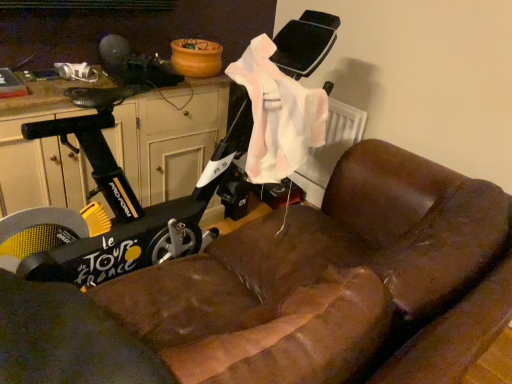
What do you see at coordinates (169, 137) in the screenshot? Image resolution: width=512 pixels, height=384 pixels. I see `wooden dresser at left` at bounding box center [169, 137].

Image resolution: width=512 pixels, height=384 pixels. Find the location of `wooden dresser at left`. wooden dresser at left is located at coordinates (169, 137).

The image size is (512, 384). In order to click on brown leather couch at lower right in this screenshot , I will do (293, 293).

Describe the element at coordinates (293, 293) in the screenshot. I see `brown leather couch at lower right` at that location.

Locate an element on the screen. wooden dresser at left is located at coordinates click(169, 137).

Between brown leather couch at lower right and wooden dresser at left, which one appears on the left side from the viewer's perspective?

wooden dresser at left is more to the left.

Is the depth of brown leather couch at lower right greater than that of wooden dresser at left?

That is False.

Is point (305, 380) closer to camera compared to point (189, 170)?

Yes.

From the image's perspective, is brown leather couch at lower right on top of wooden dresser at left?

Incorrect, from the image's perspective, brown leather couch at lower right is lower than wooden dresser at left.

From a real-world perspective, between brown leather couch at lower right and wooden dresser at left, who is vertically lower?

brown leather couch at lower right.

Which of these two, brown leather couch at lower right or wooden dresser at left, is thinner?

wooden dresser at left is thinner.

Between brown leather couch at lower right and wooden dresser at left, which one has less height?

Standing shorter between the two is wooden dresser at left.

Can you confirm if brown leather couch at lower right is smaller than wooden dresser at left?

No.

Is brown leather couch at lower right not within wooden dresser at left?

Yes.

Are brown leather couch at lower right and wooden dresser at left located far from each other?

They are positioned close to each other.

Is brown leather couch at lower right facing away from wooden dresser at left?

brown leather couch at lower right is not turned away from wooden dresser at left.

In the scene shown: What's the angular difference between brown leather couch at lower right and wooden dresser at left's facing directions?

There is a 179-degree angle between the facing directions of brown leather couch at lower right and wooden dresser at left.

Measure the distance between brown leather couch at lower right and wooden dresser at left.

brown leather couch at lower right is 78.13 centimeters from wooden dresser at left.

Locate an element on the screen. dresser above the brown leather couch at lower right (from the image's perspective) is located at coordinates (169, 137).

Looking at this image, considering the positions of objects wooden dresser at left and brown leather couch at lower right in the image provided, who is more to the right, wooden dresser at left or brown leather couch at lower right?

Positioned to the right is brown leather couch at lower right.

Which object is further away from the camera, wooden dresser at left or brown leather couch at lower right?

wooden dresser at left is further away from the camera.

Between point (210, 82) and point (389, 185), which one is positioned in front?

The point (389, 185) is closer.

From the image's perspective, between wooden dresser at left and brown leather couch at lower right, who is located below?

brown leather couch at lower right is shown below in the image.

From a real-world perspective, which object rests below the other?

brown leather couch at lower right, from a real-world perspective.

Considering the relative sizes of wooden dresser at left and brown leather couch at lower right in the image provided, is wooden dresser at left thinner than brown leather couch at lower right?

Indeed, wooden dresser at left has a lesser width compared to brown leather couch at lower right.

In the scene shown: Between wooden dresser at left and brown leather couch at lower right, which one has less height?

With less height is wooden dresser at left.

In terms of size, does wooden dresser at left appear bigger or smaller than brown leather couch at lower right?

wooden dresser at left is smaller than brown leather couch at lower right.

Is wooden dresser at left located outside brown leather couch at lower right?

Yes, wooden dresser at left is not within brown leather couch at lower right.

Would you say wooden dresser at left is a long distance from brown leather couch at lower right?

No, wooden dresser at left is not far away from brown leather couch at lower right.

Is wooden dresser at left facing away from brown leather couch at lower right?

No, wooden dresser at left is not facing the opposite direction of brown leather couch at lower right.

Based on the photo, how much distance is there between wooden dresser at left and brown leather couch at lower right?

wooden dresser at left and brown leather couch at lower right are 30.76 inches apart.

The height and width of the screenshot is (384, 512). In order to click on dresser above the brown leather couch at lower right (from a real-world perspective) in this screenshot , I will do `click(169, 137)`.

Identify the location of dresser above the brown leather couch at lower right (from a real-world perspective). Image resolution: width=512 pixels, height=384 pixels. (169, 137).

Find the location of a particular element. The width and height of the screenshot is (512, 384). studio couch below the wooden dresser at left (from a real-world perspective) is located at coordinates (293, 293).